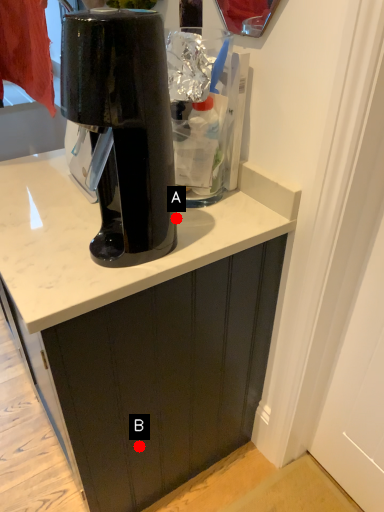
Question: Two points are circled on the image, labeled by A and B beside each circle. Which point is closer to the camera?

Choices:
 (A) A is closer
 (B) B is closer

Answer: (A)